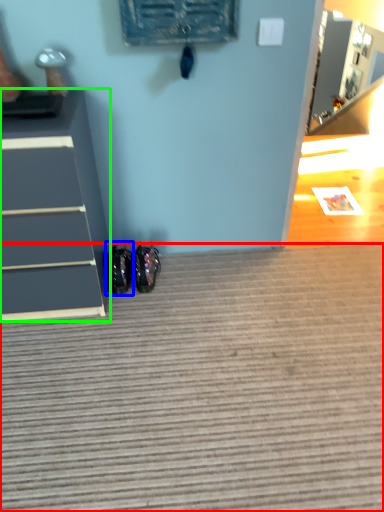
Question: Considering the real-world distances, which object is closest to doormat (highlighted by a red box)? footwear (highlighted by a blue box) or chest of drawers (highlighted by a green box).

Choices:
 (A) footwear
 (B) chest of drawers

Answer: (B)